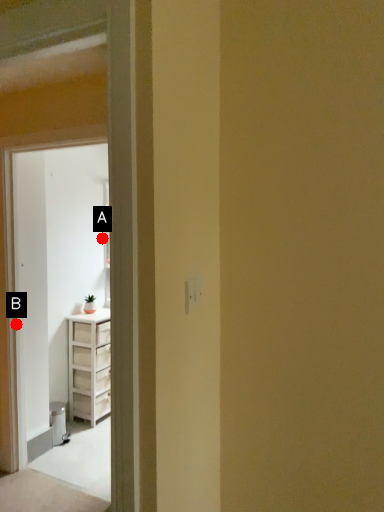
Question: Two points are circled on the image, labeled by A and B beside each circle. Which point is farther to the camera?

Choices:
 (A) A is further
 (B) B is further

Answer: (A)